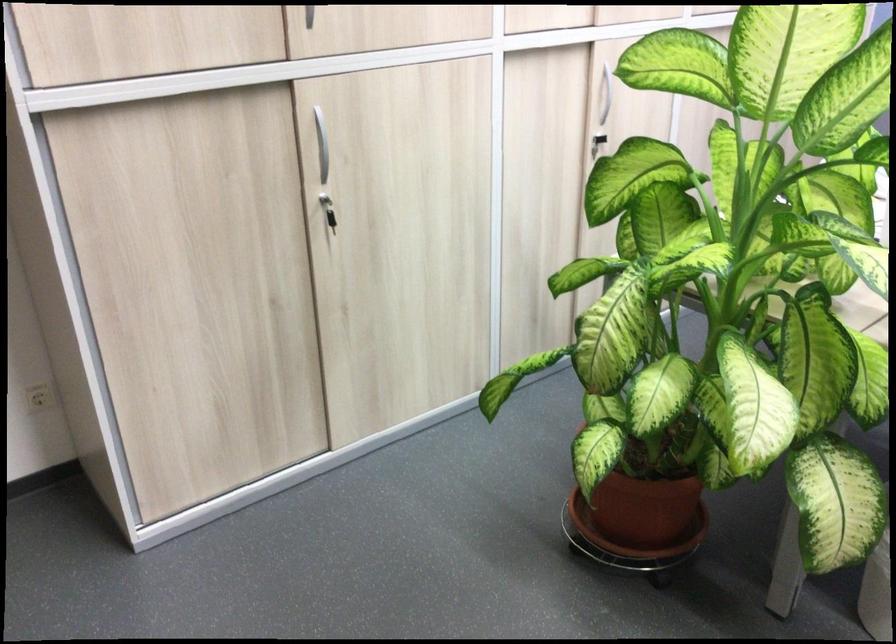
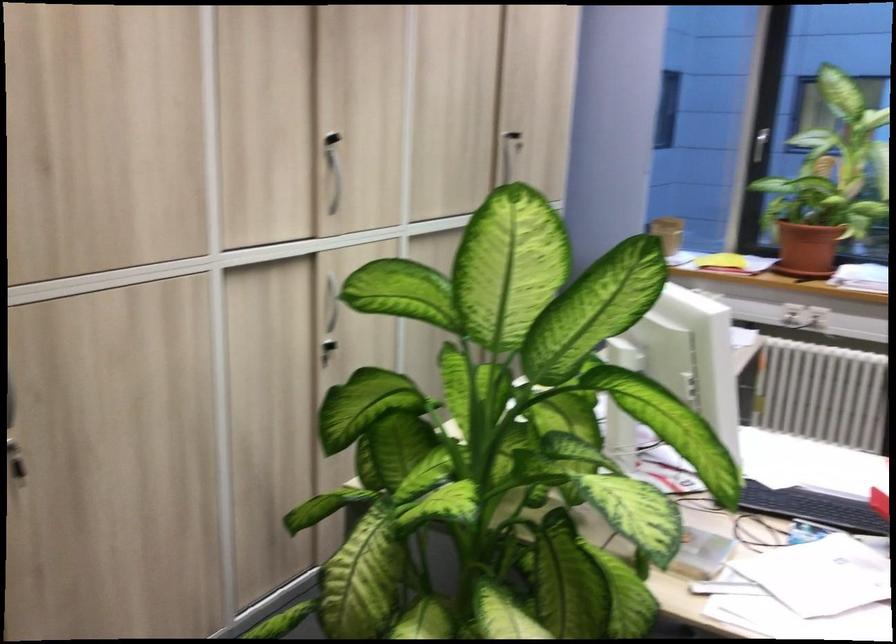
Which direction would the cameraman need to move to produce the second image?

The cameraman moved toward right, forward.